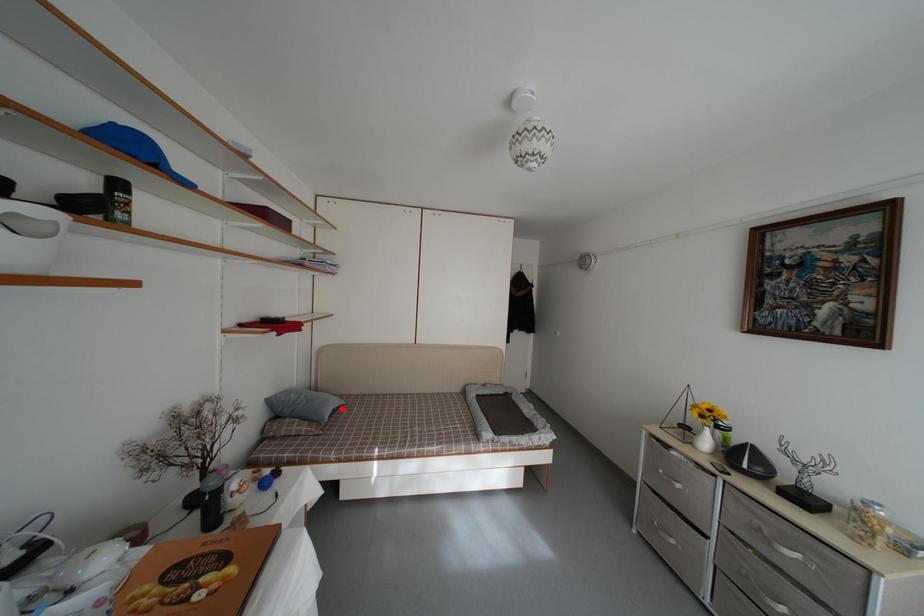
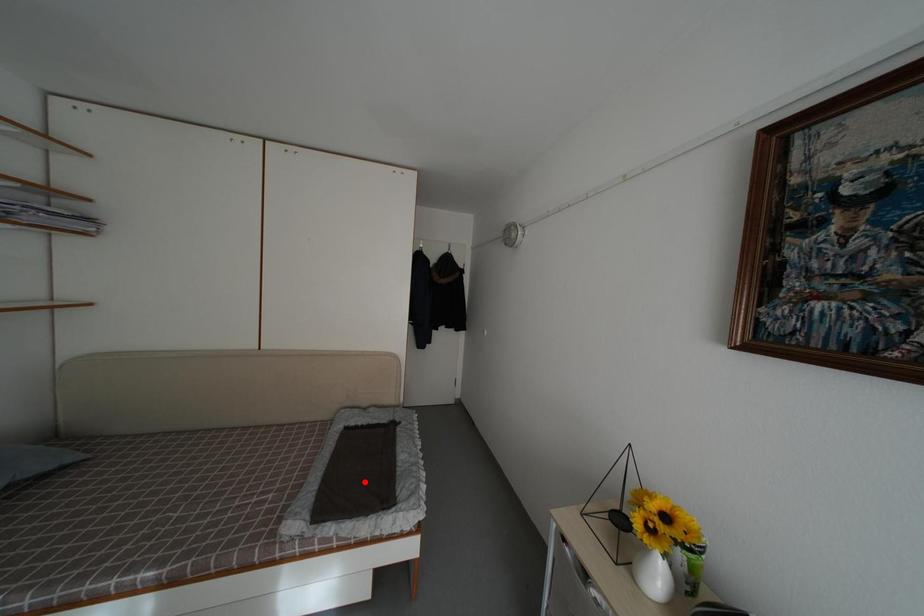
I am providing you with two images of the same scene from different viewpoints. A red point is marked on the first image and another point is marked on the second image. Is the red point in image1 aligned with the point shown in image2?

No